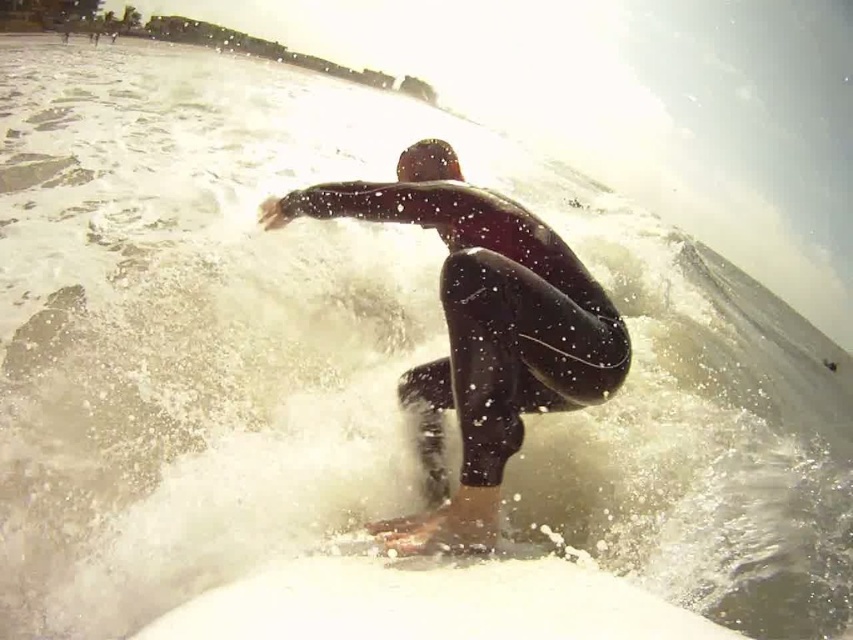
You are a photographer trying to capture the surfer in the scene. Since the black wetsuit surfer at center and the white foam surfboard at center are both in focus, which one would appear closer to the camera based on their sizes?

The black wetsuit surfer at center appears closer to the camera because it is larger in size than the white foam surfboard at center.

Based on the photo, you are a photographer trying to capture the surfer in the scene. Since the black wetsuit surfer at center and white foam surfboard at center are both at the center, how can you adjust your camera angle to clearly show which object is on top?

The black wetsuit surfer at center is positioned over the white foam surfboard at center. To clearly show this, tilt your camera slightly downward to emphasize the surfer above the surfboard.

You are a photographer trying to capture the surfer in the image. If you want to focus on the taller object between the black wetsuit surfer at center and the white foam surfboard at center, which one should you aim your camera at?

The black wetsuit surfer at center is much taller than the white foam surfboard at center, so you should aim your camera at the black wetsuit surfer at center to focus on the taller object.